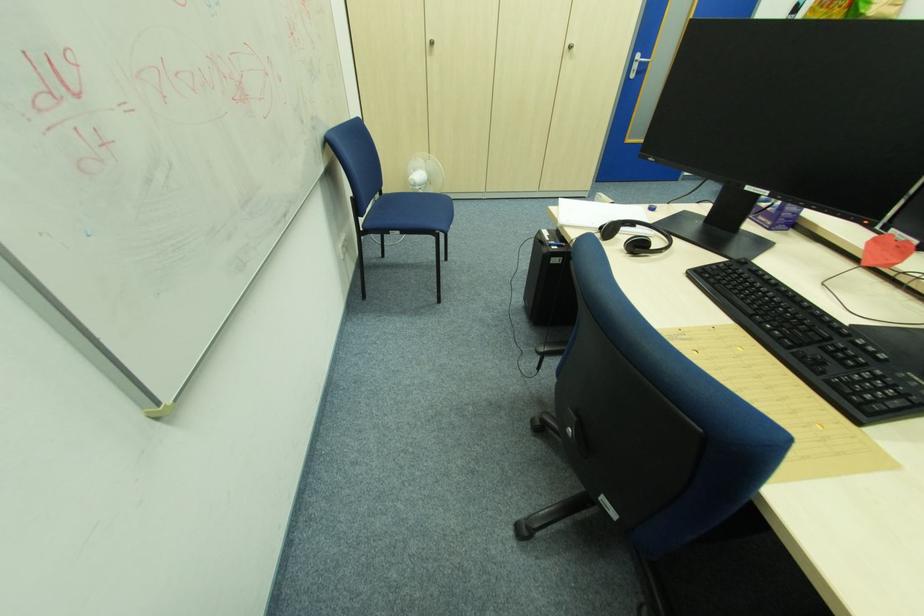
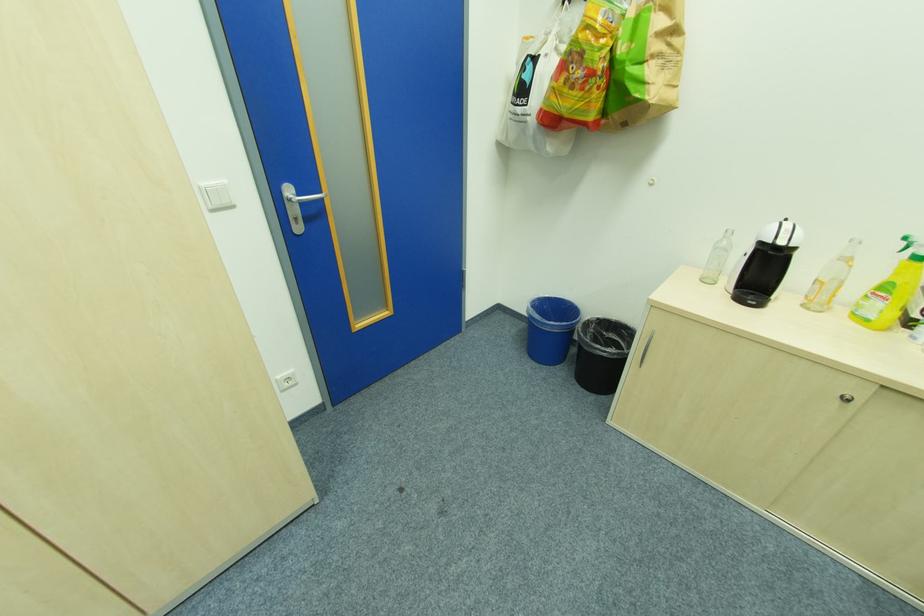
Locate, in the second image, the point that corresponds to point 647,61 in the first image.

(304, 196)